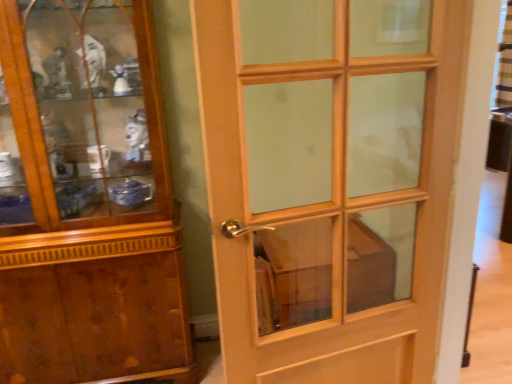
Question: From a real-world perspective, is light wood/glass door at center located beneath wooden polished cupboard at left?

Choices:
 (A) yes
 (B) no

Answer: (B)

Question: From the image's perspective, is light wood/glass door at center located beneath wooden polished cupboard at left?

Choices:
 (A) yes
 (B) no

Answer: (A)

Question: From a real-world perspective, is light wood/glass door at center positioned over wooden polished cupboard at left based on gravity?

Choices:
 (A) no
 (B) yes

Answer: (B)

Question: Is light wood/glass door at center positioned beyond the bounds of wooden polished cupboard at left?

Choices:
 (A) yes
 (B) no

Answer: (A)

Question: Can you confirm if light wood/glass door at center is wider than wooden polished cupboard at left?

Choices:
 (A) no
 (B) yes

Answer: (A)

Question: Is light wood/glass door at center at the left side of wooden polished cupboard at left?

Choices:
 (A) yes
 (B) no

Answer: (B)

Question: Is wooden polished cupboard at left thinner than light wood/glass door at center?

Choices:
 (A) yes
 (B) no

Answer: (B)

Question: Is wooden polished cupboard at left to the right of light wood/glass door at center from the viewer's perspective?

Choices:
 (A) yes
 (B) no

Answer: (B)

Question: From the image's perspective, is wooden polished cupboard at left beneath light wood/glass door at center?

Choices:
 (A) yes
 (B) no

Answer: (B)

Question: Is wooden polished cupboard at left further to the viewer compared to light wood/glass door at center?

Choices:
 (A) yes
 (B) no

Answer: (A)

Question: From a real-world perspective, is wooden polished cupboard at left on light wood/glass door at center?

Choices:
 (A) no
 (B) yes

Answer: (A)

Question: Considering the relative sizes of wooden polished cupboard at left and light wood/glass door at center in the image provided, is wooden polished cupboard at left shorter than light wood/glass door at center?

Choices:
 (A) no
 (B) yes

Answer: (A)

Question: In terms of height, does wooden polished cupboard at left look taller or shorter compared to light wood/glass door at center?

Choices:
 (A) short
 (B) tall

Answer: (B)